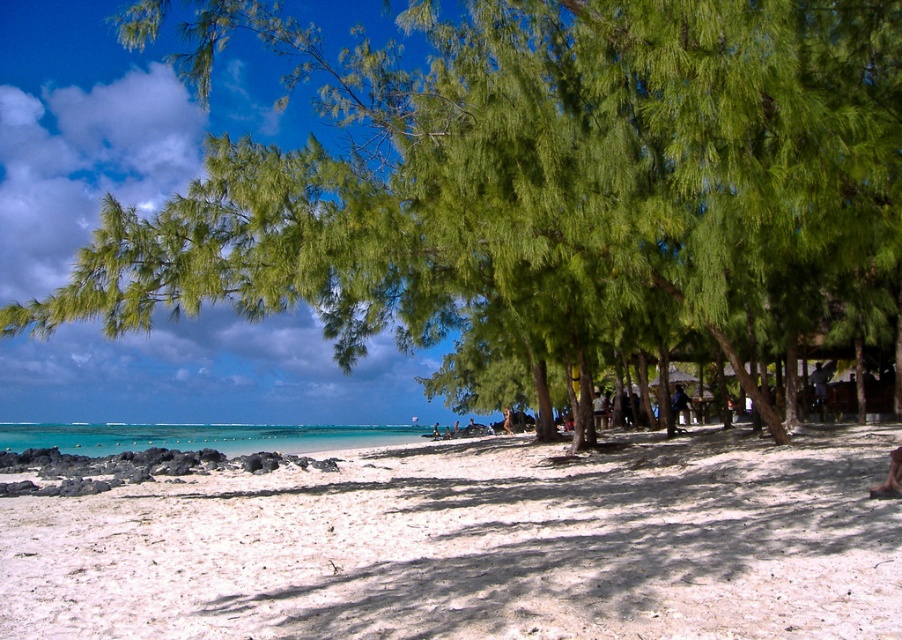
Between point (81, 291) and point (17, 429), which one is positioned in front?

Point (81, 291)

Locate an element on the screen. The height and width of the screenshot is (640, 902). green leafy tree at center is located at coordinates (542, 193).

Does green leafy tree at center have a larger size compared to white sandy beach at lower center?

Indeed, green leafy tree at center has a larger size compared to white sandy beach at lower center.

Is green leafy tree at center further to the viewer compared to white sandy beach at lower center?

Yes, it is behind white sandy beach at lower center.

Identify the location of green leafy tree at center. (542, 193).

Image resolution: width=902 pixels, height=640 pixels. I want to click on green leafy tree at center, so click(542, 193).

Is white sandy beach at lower center positioned at the back of turquoise water at lower left?

No.

Is white sandy beach at lower center bigger than turquoise water at lower left?

Incorrect, white sandy beach at lower center is not larger than turquoise water at lower left.

Is point (468, 445) farther from viewer compared to point (318, 448)?

No, (468, 445) is in front of (318, 448).

I want to click on white sandy beach at lower center, so click(477, 545).